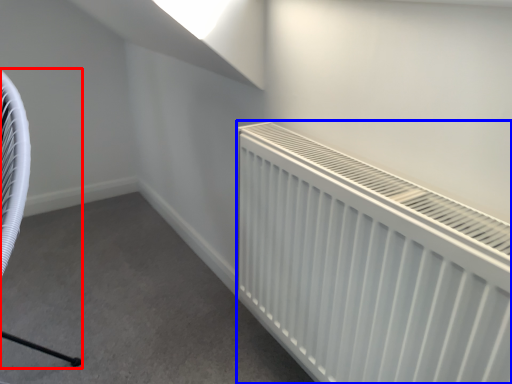
Question: Which object appears farthest to the camera in this image, swivel chair (highlighted by a red box) or radiator (highlighted by a blue box)?

Choices:
 (A) swivel chair
 (B) radiator

Answer: (B)